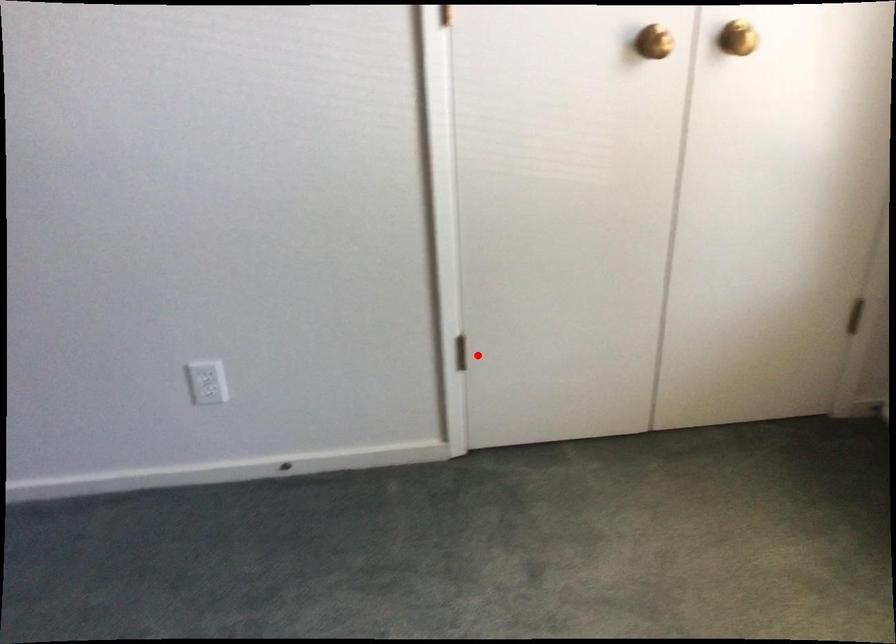
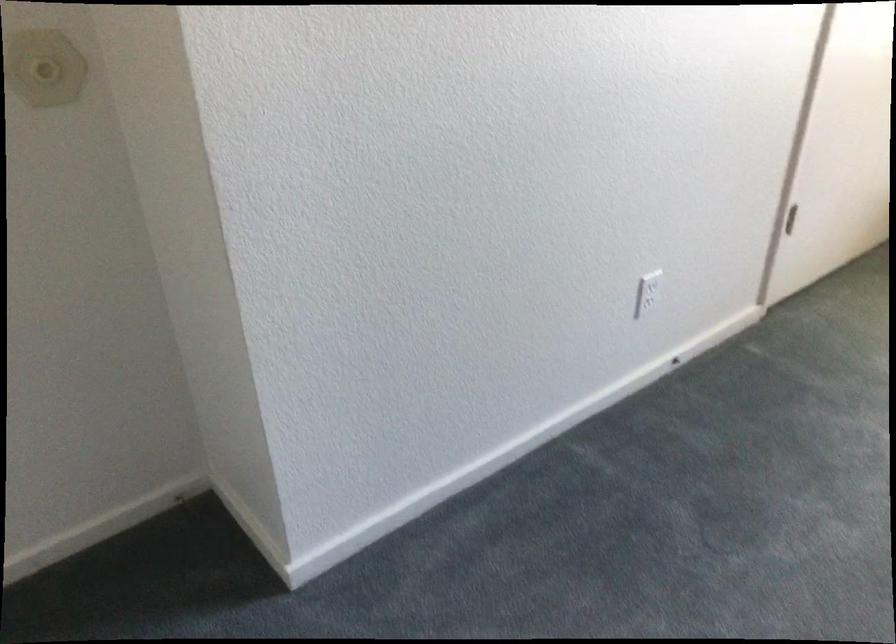
Question: A red point is marked in image1. In image2, is the corresponding 3D point closer to the camera or farther? Reply with the corresponding letter.

Choices:
 (A) The corresponding 3D point is closer.
 (B) The corresponding 3D point is farther.

Answer: (B)